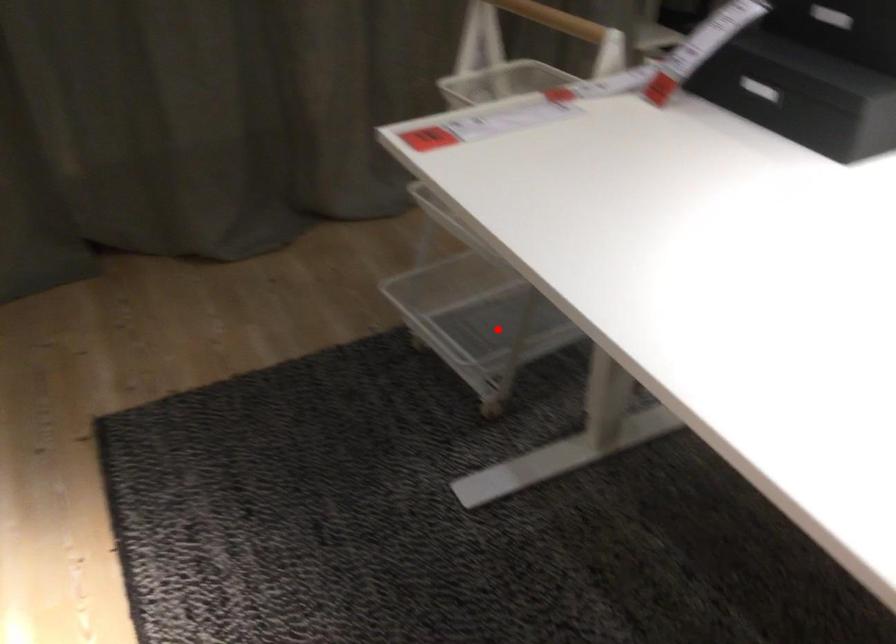
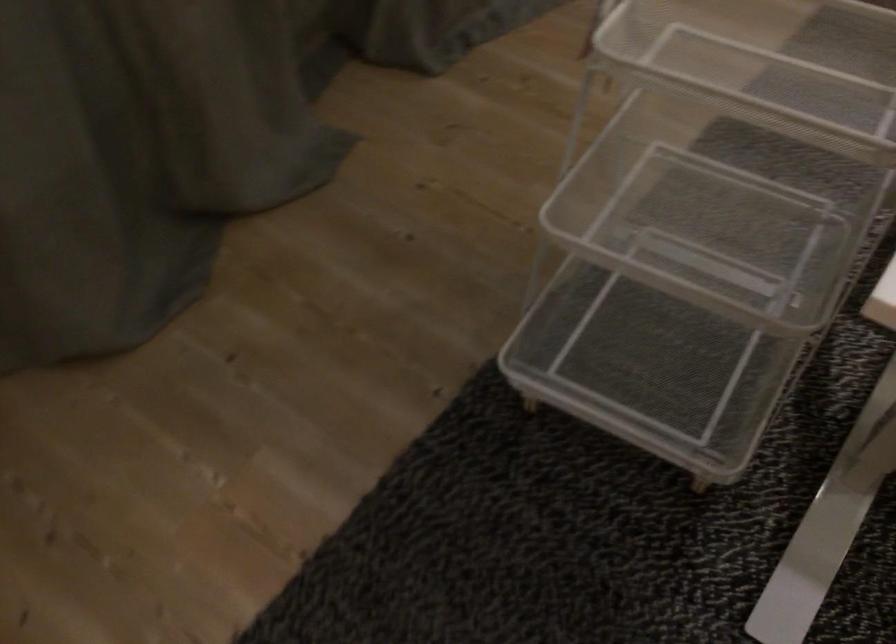
Locate, in the second image, the point that corresponds to the highlighted location in the first image.

(651, 361)